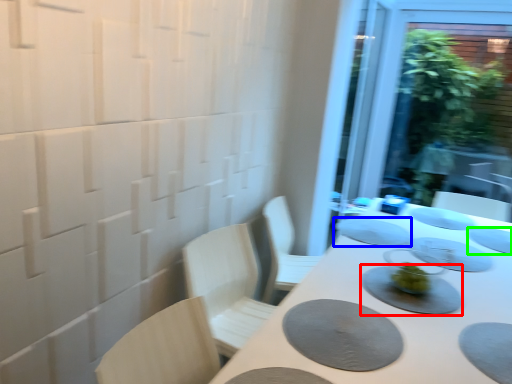
Question: Which object is positioned farthest from tableware (highlighted by a red box)? Select from tableware (highlighted by a blue box) and tableware (highlighted by a green box).

Choices:
 (A) tableware
 (B) tableware

Answer: (B)